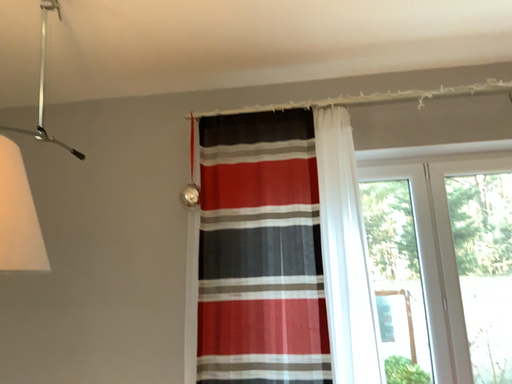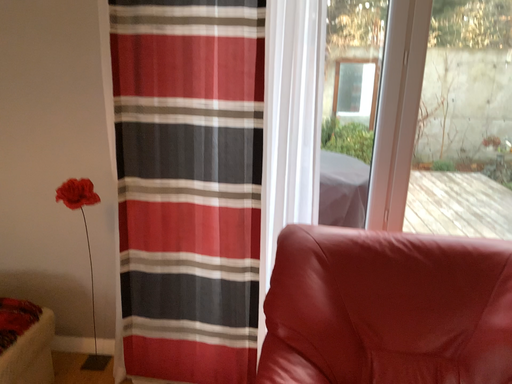
Question: Which way did the camera rotate in the video?

Choices:
 (A) rotated upward
 (B) rotated downward

Answer: (B)